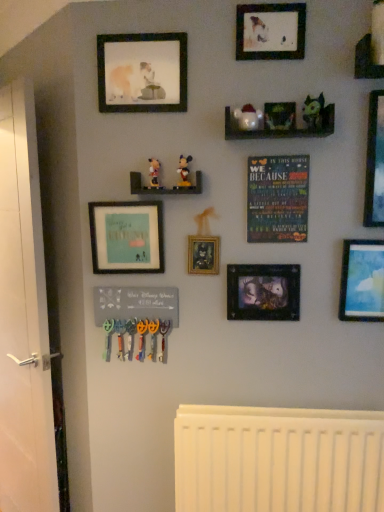
Find the location of a particular element. white plastic radiator at lower center is located at coordinates (278, 459).

What do you see at coordinates (277, 199) in the screenshot? This screenshot has height=512, width=384. I see `wooden poster at center` at bounding box center [277, 199].

Image resolution: width=384 pixels, height=512 pixels. Describe the element at coordinates (362, 281) in the screenshot. I see `matte blue sky at right, which ranks as the sixth picture frame in left-to-right order` at that location.

This screenshot has width=384, height=512. What are the coordinates of `metallic silver picture frame at upper right, which is counted as the 7th picture frame, starting from the left` in the screenshot? It's located at (375, 162).

Describe the element at coordinates (270, 31) in the screenshot. I see `matte black picture frame at upper center, which appears as the 5th picture frame when viewed from the left` at that location.

Find the location of a particular element. The image size is (384, 512). metallic silver picture frame at center, which is the fourth picture frame in left-to-right order is located at coordinates (263, 292).

At what (x,y) coordinates should I click in order to perform the action: click on wooden shelf at upper center, which ranks as the second shelf in right-to-left order. Please return your answer as a coordinate pair (x, y). This screenshot has width=384, height=512. Looking at the image, I should click on (280, 130).

Does matte black picture frame at upper center, which appears as the 5th picture frame when viewed from the left, have a greater height compared to matte blue sky at right, which ranks as the 2th picture frame in right-to-left order?

Incorrect, the height of matte black picture frame at upper center, which appears as the 5th picture frame when viewed from the left, is not larger of that of matte blue sky at right, which ranks as the 2th picture frame in right-to-left order.

Who is smaller, matte black picture frame at upper center, positioned as the 3th picture frame in right-to-left order, or matte blue sky at right, which ranks as the sixth picture frame in left-to-right order?

matte black picture frame at upper center, positioned as the 3th picture frame in right-to-left order, is smaller.

Is matte black picture frame at upper center, which appears as the 5th picture frame when viewed from the left, at the right side of matte blue sky at right, which ranks as the sixth picture frame in left-to-right order?

Incorrect, matte black picture frame at upper center, which appears as the 5th picture frame when viewed from the left, is not on the right side of matte blue sky at right, which ranks as the sixth picture frame in left-to-right order.

Considering their positions, is wooden shelf at upper center, which ranks as the second shelf in right-to-left order, located in front of or behind matte black picture frame at upper center, the 6th picture frame from the right?

In the image, wooden shelf at upper center, which ranks as the second shelf in right-to-left order, appears in front of matte black picture frame at upper center, the 6th picture frame from the right.

From the image's perspective, starting from the wooden shelf at upper center, the 2th shelf viewed from the left, which picture frame is the 1st one above? Please provide its 2D coordinates.

[(142, 72)]

Are wooden shelf at upper center, the 2th shelf viewed from the left, and matte black picture frame at upper center, the 6th picture frame from the right, beside each other?

No, wooden shelf at upper center, the 2th shelf viewed from the left, is not making contact with matte black picture frame at upper center, the 6th picture frame from the right.

Is wooden shelf at upper center, marked as the 2th shelf in a top-to-bottom arrangement, not inside matte black picture frame at upper center, acting as the second picture frame starting from the left?

Indeed, wooden shelf at upper center, marked as the 2th shelf in a top-to-bottom arrangement, is completely outside matte black picture frame at upper center, acting as the second picture frame starting from the left.

How different are the orientations of gold metallic picture frame at center, arranged as the 3th picture frame when viewed from the left, and wooden mickey mouse figurines at center, placed as the first shelf when sorted from bottom to top, in degrees?

0.671 degrees separate the facing orientations of gold metallic picture frame at center, arranged as the 3th picture frame when viewed from the left, and wooden mickey mouse figurines at center, placed as the first shelf when sorted from bottom to top.

Are gold metallic picture frame at center, the 5th picture frame positioned from the right, and wooden mickey mouse figurines at center, the 1th shelf positioned from the left, far apart?

No, gold metallic picture frame at center, the 5th picture frame positioned from the right, is not far away from wooden mickey mouse figurines at center, the 1th shelf positioned from the left.

From a real-world perspective, is gold metallic picture frame at center, the 5th picture frame positioned from the right, located beneath wooden mickey mouse figurines at center, the 1th shelf positioned from the left?

Indeed, from a real-world perspective, gold metallic picture frame at center, the 5th picture frame positioned from the right, is positioned beneath wooden mickey mouse figurines at center, the 1th shelf positioned from the left.

Is metallic silver picture frame at upper right, the 1th picture frame positioned from the right, not close to matte blue sky at right, which ranks as the 2th picture frame in right-to-left order?

No, metallic silver picture frame at upper right, the 1th picture frame positioned from the right, is in close proximity to matte blue sky at right, which ranks as the 2th picture frame in right-to-left order.

Is point (372, 136) positioned after point (364, 297)?

That is False.

Which object is closer to the camera taking this photo, metallic silver picture frame at upper right, the 1th picture frame positioned from the right, or matte blue sky at right, which ranks as the 2th picture frame in right-to-left order?

metallic silver picture frame at upper right, the 1th picture frame positioned from the right, is closer to the camera.

How distant is metallic silver picture frame at upper right, which is counted as the 7th picture frame, starting from the left, from matte blue sky at right, which ranks as the sixth picture frame in left-to-right order?

metallic silver picture frame at upper right, which is counted as the 7th picture frame, starting from the left, and matte blue sky at right, which ranks as the sixth picture frame in left-to-right order, are 8.82 inches apart.

Which point is more distant from viewer, (167,81) or (332,131)?

The point (167,81) is behind.

From a real-world perspective, who is located lower, matte black picture frame at upper center, the 6th picture frame from the right, or wooden shelf at upper center, marked as the 2th shelf in a top-to-bottom arrangement?

From a 3D spatial view, wooden shelf at upper center, marked as the 2th shelf in a top-to-bottom arrangement, is below.

Is matte black picture frame at upper center, acting as the second picture frame starting from the left, outside of wooden shelf at upper center, marked as the 2th shelf in a top-to-bottom arrangement?

matte black picture frame at upper center, acting as the second picture frame starting from the left, lies outside wooden shelf at upper center, marked as the 2th shelf in a top-to-bottom arrangement,'s area.

Consider the image. Could you tell me if matte black picture frame at upper center, the 6th picture frame from the right, is facing wooden shelf at upper center, marked as the 2th shelf in a top-to-bottom arrangement?

No, matte black picture frame at upper center, the 6th picture frame from the right, is not facing towards wooden shelf at upper center, marked as the 2th shelf in a top-to-bottom arrangement.

Is matte black picture frame at upper center, the 6th picture frame from the right, at the left side of matte plastic mickey mouse at center, which is counted as the third toy, starting from the right?

Correct, you'll find matte black picture frame at upper center, the 6th picture frame from the right, to the left of matte plastic mickey mouse at center, which is counted as the third toy, starting from the right.

In terms of size, does matte black picture frame at upper center, acting as the second picture frame starting from the left, appear bigger or smaller than matte plastic mickey mouse at center, positioned as the 2th toy in left-to-right order?

Clearly, matte black picture frame at upper center, acting as the second picture frame starting from the left, is larger in size than matte plastic mickey mouse at center, positioned as the 2th toy in left-to-right order.

Can you confirm if matte black picture frame at upper center, the 6th picture frame from the right, is wider than matte plastic mickey mouse at center, positioned as the 2th toy in left-to-right order?

In fact, matte black picture frame at upper center, the 6th picture frame from the right, might be narrower than matte plastic mickey mouse at center, positioned as the 2th toy in left-to-right order.

Is point (153, 87) closer to viewer compared to point (185, 175)?

Yes, it is in front of point (185, 175).

How different are the orientations of matte green plush toy at upper right, which ranks as the first toy in right-to-left order, and white plastic radiator at lower center in degrees?

2.81 degrees separate the facing orientations of matte green plush toy at upper right, which ranks as the first toy in right-to-left order, and white plastic radiator at lower center.

Is there a large distance between matte green plush toy at upper right, which ranks as the first toy in right-to-left order, and white plastic radiator at lower center?

That's right, there is a large distance between matte green plush toy at upper right, which ranks as the first toy in right-to-left order, and white plastic radiator at lower center.

Considering the relative sizes of matte green plush toy at upper right, which ranks as the first toy in right-to-left order, and white plastic radiator at lower center in the image provided, is matte green plush toy at upper right, which ranks as the first toy in right-to-left order, thinner than white plastic radiator at lower center?

Indeed, matte green plush toy at upper right, which ranks as the first toy in right-to-left order, has a lesser width compared to white plastic radiator at lower center.

Find the location of `the 4th toy in front of the white plastic radiator at lower center`. the 4th toy in front of the white plastic radiator at lower center is located at coordinates (313, 112).

Image resolution: width=384 pixels, height=512 pixels. I want to click on picture frame that is the 1st object to the right of the matte black picture frame at upper center, which appears as the 5th picture frame when viewed from the left, starting at the anchor, so click(x=362, y=281).

You are a GUI agent. You are given a task and a screenshot of the screen. Output one action in this format:
    pyautogui.click(x=<x>, y=<y>)
    Task: Click on the 1st shelf positioned below the matte black picture frame at upper center, acting as the second picture frame starting from the left (from a real-world perspective)
    This screenshot has width=384, height=512.
    Given the screenshot: What is the action you would take?
    pos(280,130)

Based on their spatial positions, is wooden poster at center or wooden mickey mouse figurines at center, placed as the first shelf when sorted from bottom to top, further from metallic silver picture frame at upper right, which is counted as the 7th picture frame, starting from the left?

wooden mickey mouse figurines at center, placed as the first shelf when sorted from bottom to top, is positioned further to the anchor metallic silver picture frame at upper right, which is counted as the 7th picture frame, starting from the left.

Looking at the image, which one is located further to matte plastic mickey mouse at center, the fourth toy from the right, white plastic radiator at lower center or glossy ceramic piggy bank at upper center, arranged as the third toy when viewed from the left?

white plastic radiator at lower center is positioned further to the anchor matte plastic mickey mouse at center, the fourth toy from the right.

Looking at the image, which one is located further to wooden shelf at upper center, which ranks as the second shelf in right-to-left order, matte plastic mickey mouse at center, the fourth toy from the right, or matte blue frame at center left, marked as the 1th picture frame in a left-to-right arrangement?

matte blue frame at center left, marked as the 1th picture frame in a left-to-right arrangement, lies further to wooden shelf at upper center, which ranks as the second shelf in right-to-left order, than the other object.

Which object lies nearer to the anchor point matte black picture frame at upper center, acting as the second picture frame starting from the left, wooden shelf at upper center, which ranks as the second shelf in right-to-left order, or wooden shelf at upper right, the 1th shelf viewed from the top?

wooden shelf at upper center, which ranks as the second shelf in right-to-left order.

Based on their spatial positions, is wooden mickey mouse figurines at center, which is counted as the 3th shelf, starting from the right, or metallic silver picture frame at upper right, which is counted as the 7th picture frame, starting from the left, closer to matte plastic mickey mouse at center, positioned as the 2th toy in left-to-right order?

Among the two, wooden mickey mouse figurines at center, which is counted as the 3th shelf, starting from the right, is located nearer to matte plastic mickey mouse at center, positioned as the 2th toy in left-to-right order.

Estimate the real-world distances between objects in this image. Which object is further from wooden poster at center, wooden mickey mouse figurines at center, placed as the first shelf when sorted from bottom to top, or metallic silver picture frame at upper right, which is counted as the 7th picture frame, starting from the left?

wooden mickey mouse figurines at center, placed as the first shelf when sorted from bottom to top, is positioned further to the anchor wooden poster at center.

Based on their spatial positions, is matte blue frame at center left, marked as the 1th picture frame in a left-to-right arrangement, or white glossy door at left further from matte plastic mickey mouse at center, marked as the 1th toy in a left-to-right arrangement?

Among the two, white glossy door at left is located further to matte plastic mickey mouse at center, marked as the 1th toy in a left-to-right arrangement.

Estimate the real-world distances between objects in this image. Which object is further from wooden shelf at upper center, the 2th shelf viewed from the left, metallic silver picture frame at upper right, the 1th picture frame positioned from the right, or matte plastic mickey mouse at center, the fourth toy from the right?

matte plastic mickey mouse at center, the fourth toy from the right, is positioned further to the anchor wooden shelf at upper center, the 2th shelf viewed from the left.

Where is `toy located between glossy ceramic piggy bank at upper center, arranged as the third toy when viewed from the left, and wooden shelf at upper right, which is counted as the 1th shelf, starting from the right, in the left-right direction`? toy located between glossy ceramic piggy bank at upper center, arranged as the third toy when viewed from the left, and wooden shelf at upper right, which is counted as the 1th shelf, starting from the right, in the left-right direction is located at coordinates (313, 112).

Find the location of `bulletin board located between matte black picture frame at upper center, the 6th picture frame from the right, and matte green plush toy at upper right, which ranks as the first toy in right-to-left order, in the left-right direction`. bulletin board located between matte black picture frame at upper center, the 6th picture frame from the right, and matte green plush toy at upper right, which ranks as the first toy in right-to-left order, in the left-right direction is located at coordinates (277, 199).

What are the coordinates of `shelf situated between white glossy door at left and wooden shelf at upper center, which ranks as the second shelf in right-to-left order, from left to right` in the screenshot? It's located at (163, 187).

What are the coordinates of `shelf that lies between wooden shelf at upper center, which ranks as the second shelf in right-to-left order, and white plastic radiator at lower center from top to bottom` in the screenshot? It's located at (163, 187).